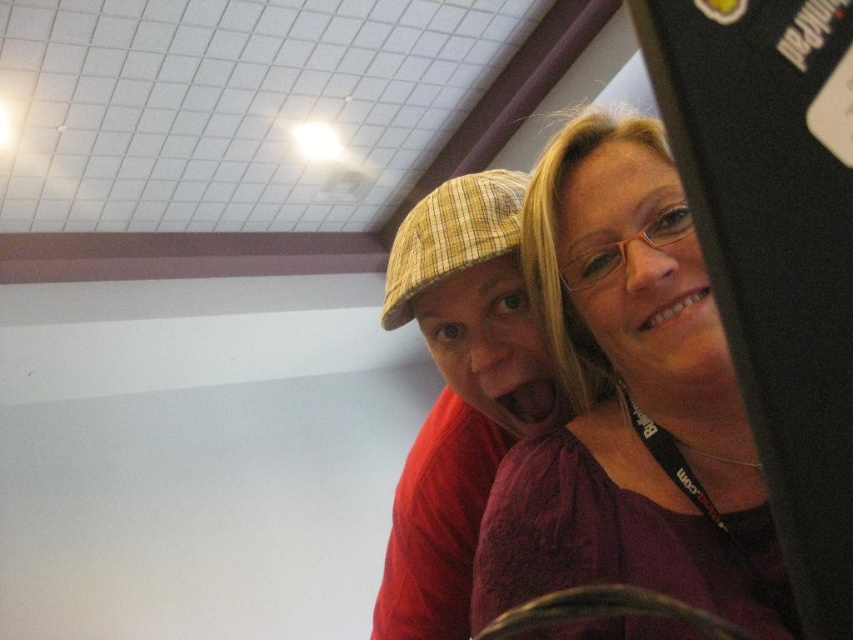
You are designing a layout for a photo shoot and need to place a small prop between the matte purple blouse at upper right and the plaid fabric cap at center. Based on their widths, which object should the prop be closer to to maintain visual balance?

The prop should be placed closer to the plaid fabric cap at center because the matte purple blouse at upper right has a lesser width, requiring the prop to compensate for the size difference to achieve balance.

You are an interior designer assessing the layout of this room. You notice the matte purple blouse at upper right and the plaid fabric cap at center. Which object is shorter in height?

The matte purple blouse at upper right is shorter in height compared to the plaid fabric cap at center.

You are a photographer setting up a shoot in the room described. You need to position a light source between the matte purple blouse at upper right and the black glossy monitor at upper right. Based on their positions, which object should the light be placed closer to?

The matte purple blouse at upper right is to the right of the black glossy monitor at upper right. Therefore, the light should be placed closer to the black glossy monitor at upper right to be between them.